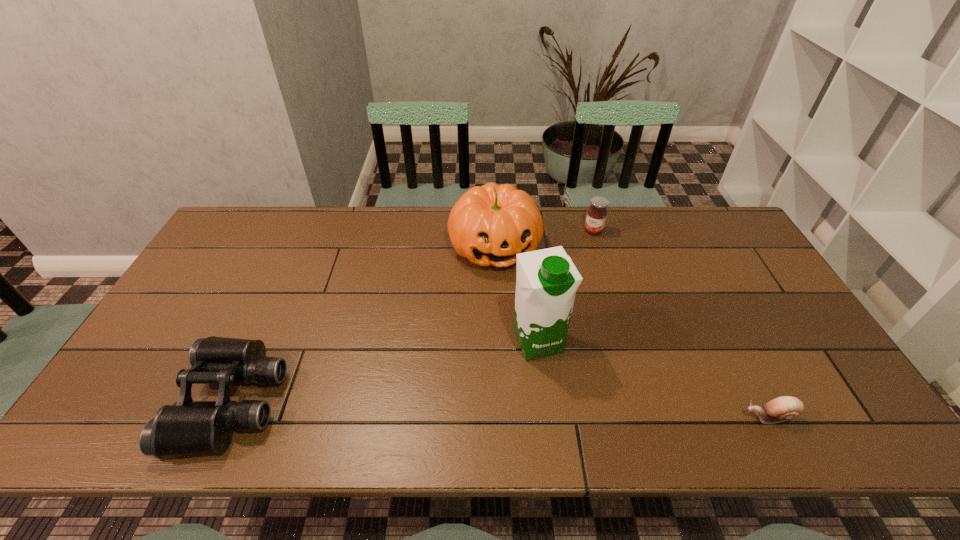
At what (x,y) coordinates should I click in order to perform the action: click on empty space that is in between the shortest object and the soya milk. Please return your answer as a coordinate pair (x, y). Looking at the image, I should click on (654, 379).

Where is `vacant point located between the shortest object and the binoculars`? vacant point located between the shortest object and the binoculars is located at coordinates (500, 409).

At what (x,y) coordinates should I click in order to perform the action: click on vacant area that lies between the jam and the rightmost object. Please return your answer as a coordinate pair (x, y). Looking at the image, I should click on (681, 323).

This screenshot has height=540, width=960. What are the coordinates of `vacant point located between the leftmost object and the soya milk` in the screenshot? It's located at (385, 372).

This screenshot has width=960, height=540. Find the location of `object that is the second closest to the binoculars`. object that is the second closest to the binoculars is located at coordinates tap(547, 280).

Point out which object is positioned as the fourth nearest to the shortest object. Please provide its 2D coordinates. Your answer should be formatted as a tuple, i.e. [(x, y)], where the tuple contains the x and y coordinates of a point satisfying the conditions above.

[(188, 427)]

In order to click on free location that satisfies the following two spatial constraints: 1. on the front side of the jam; 2. on the front-facing side of the shortest object in this screenshot , I will do `click(649, 417)`.

The image size is (960, 540). Find the location of `free space that satisfies the following two spatial constraints: 1. on the front side of the fourth shortest object; 2. on the left side of the tallest object`. free space that satisfies the following two spatial constraints: 1. on the front side of the fourth shortest object; 2. on the left side of the tallest object is located at coordinates (498, 341).